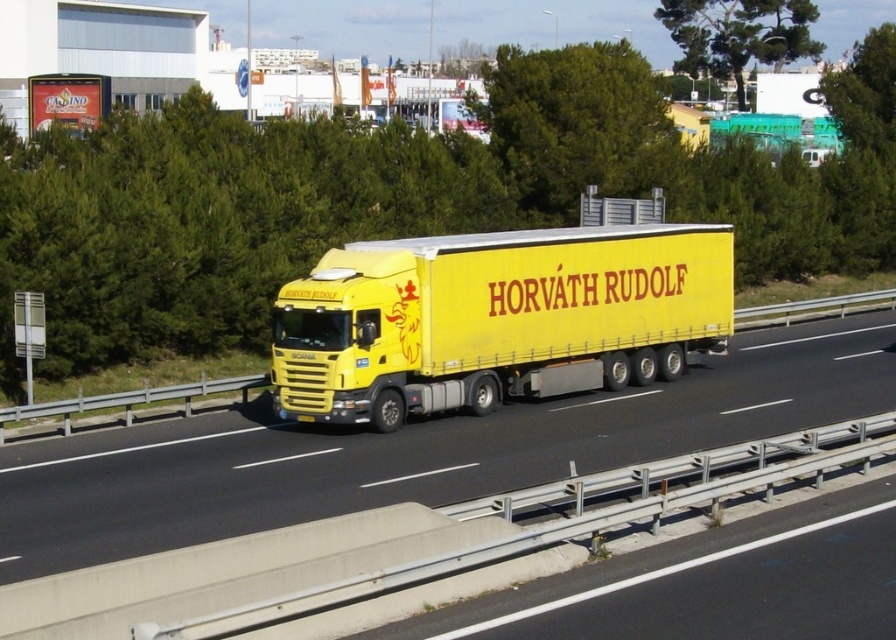
You are a photographer trying to capture the yellow matte trailer truck at center and the green leafy tree at center in a single frame. Since the truck is thinner than the tree, which object would you need to position closer to the camera to ensure both fit within the frame?

The yellow matte trailer truck at center is thinner than the green leafy tree at center. To ensure both fit within the frame, you should position the thinner yellow matte trailer truck at center closer to the camera so that its size in the photo matches the tree.